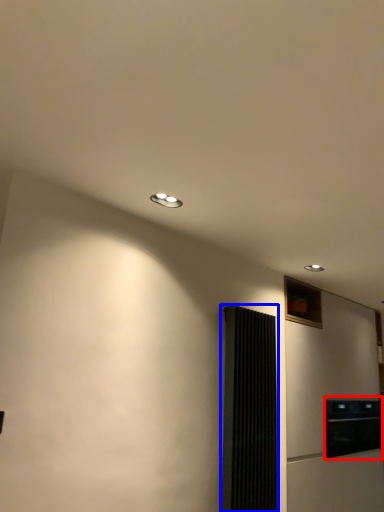
Question: Which of the following is the closest to the observer, appliance (highlighted by a red box) or screen door (highlighted by a blue box)?

Choices:
 (A) appliance
 (B) screen door

Answer: (B)